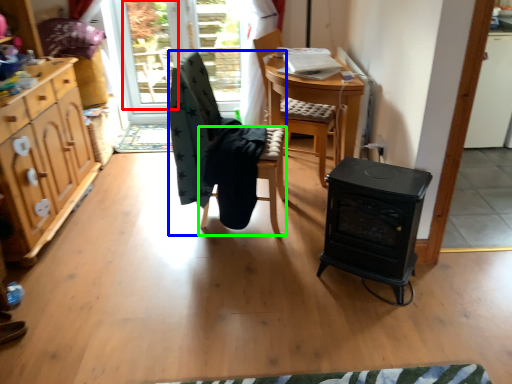
Question: Which object is the farthest from window screen (highlighted by a red box)? Choose among these: chair (highlighted by a blue box) or chair (highlighted by a green box).

Choices:
 (A) chair
 (B) chair

Answer: (B)